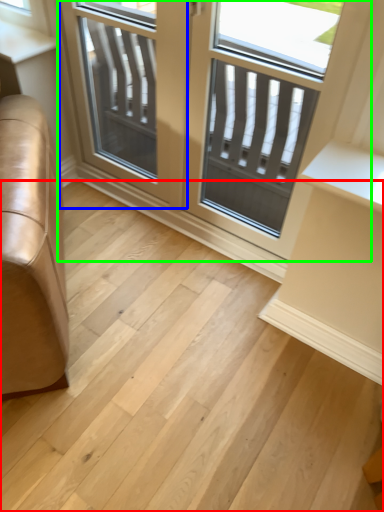
Question: Estimate the real-world distances between objects in this image. Which object is closer to stairwell (highlighted by a red box), screen door (highlighted by a blue box) or window (highlighted by a green box)?

Choices:
 (A) screen door
 (B) window

Answer: (B)